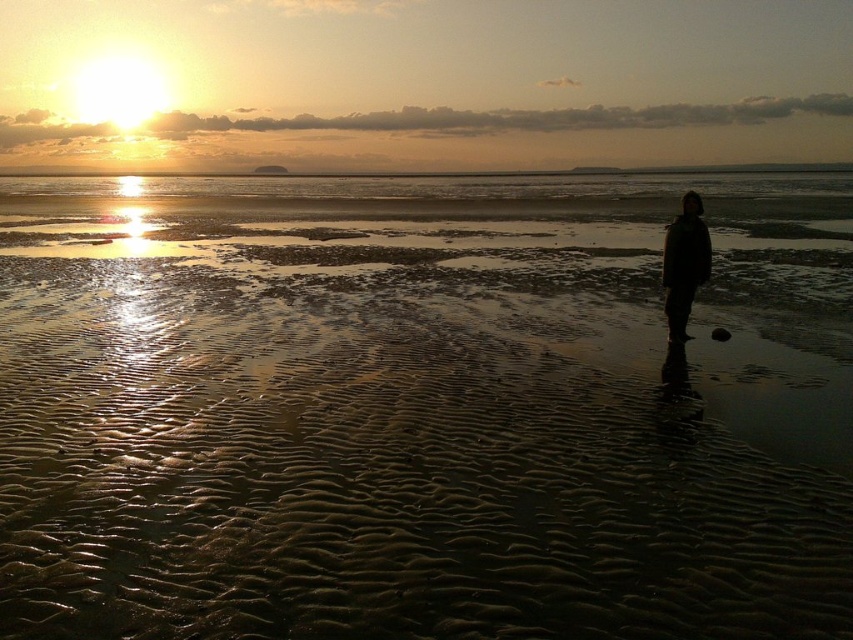
Is wet sand at center bigger than black matte coat at center?

Yes.

Does wet sand at center come behind black matte coat at center?

No, it is in front of black matte coat at center.

Is point (358, 392) closer to camera compared to point (686, 262)?

Yes, it is in front of point (686, 262).

Where is `wet sand at center`? The height and width of the screenshot is (640, 853). wet sand at center is located at coordinates (421, 410).